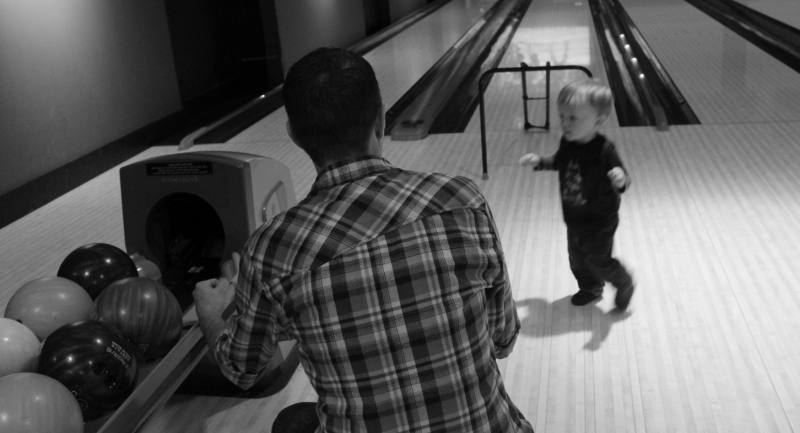
At what (x,y) coordinates should I click in order to perform the action: click on assist rail. Please return your answer as a coordinate pair (x, y). This screenshot has width=800, height=433. Looking at the image, I should click on (533, 74).